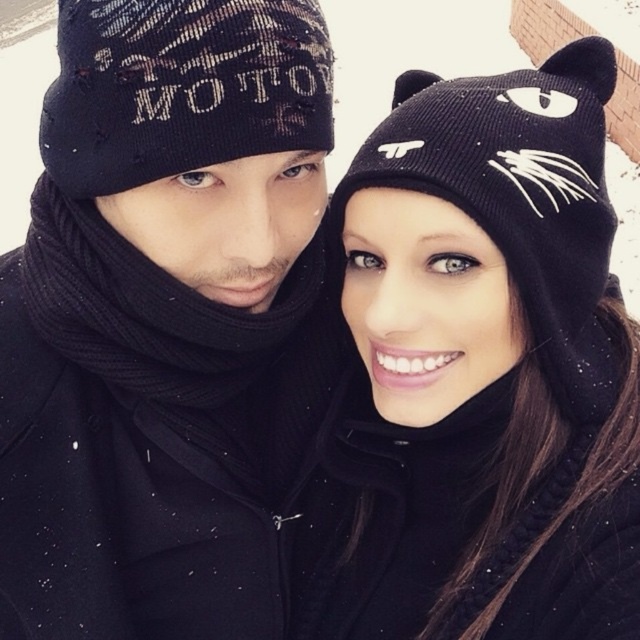
Question: Estimate the real-world distances between objects in this image. Which object is farther from the black knit beanie with cat ears at upper right?

Choices:
 (A) matte black beanie at center
 (B) black knitted beanie at left

Answer: (B)

Question: Estimate the real-world distances between objects in this image. Which object is closer to the matte black beanie at center?

Choices:
 (A) black knit beanie with cat ears at upper right
 (B) black knitted beanie at left

Answer: (B)

Question: From the image, what is the correct spatial relationship of matte black beanie at center in relation to black knit beanie with cat ears at upper right?

Choices:
 (A) above
 (B) below

Answer: (A)

Question: Is black knit beanie with cat ears at upper right bigger than black knitted beanie at left?

Choices:
 (A) no
 (B) yes

Answer: (B)

Question: Is black knit beanie with cat ears at upper right above black knitted beanie at left?

Choices:
 (A) no
 (B) yes

Answer: (A)

Question: Which point appears closest to the camera in this image?

Choices:
 (A) (108, 326)
 (B) (237, 1)

Answer: (B)